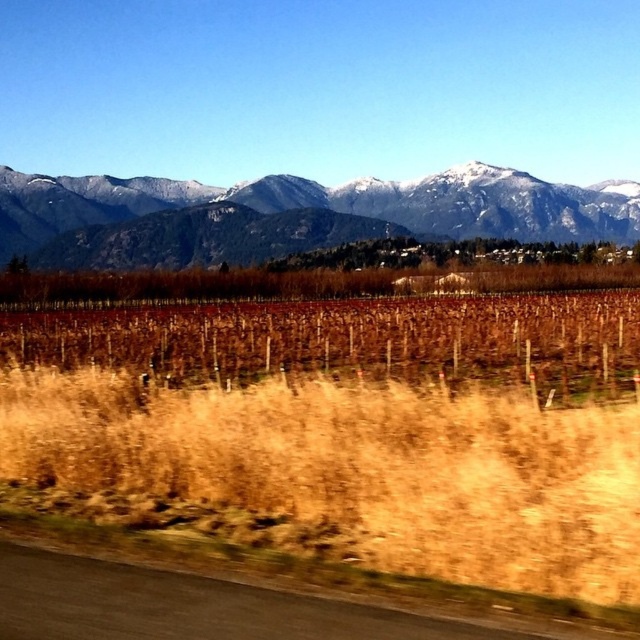
Question: Which of these objects is positioned closest to the snowy rocky mountains at upper center?

Choices:
 (A) black asphalt road at lower left
 (B) dry grass at lower center

Answer: (B)

Question: Which point is farther from the camera taking this photo?

Choices:
 (A) (129, 419)
 (B) (99, 248)
 (C) (83, 621)

Answer: (B)

Question: Considering the relative positions of dry grass at lower center and snowy rocky mountains at upper center in the image provided, where is dry grass at lower center located with respect to snowy rocky mountains at upper center?

Choices:
 (A) left
 (B) right

Answer: (A)

Question: Considering the relative positions of snowy rocky mountains at upper center and black asphalt road at lower left in the image provided, where is snowy rocky mountains at upper center located with respect to black asphalt road at lower left?

Choices:
 (A) below
 (B) above

Answer: (B)

Question: Can you confirm if dry grass at lower center is positioned to the right of snowy rocky mountains at upper center?

Choices:
 (A) yes
 (B) no

Answer: (B)

Question: Based on their relative distances, which object is farther from the dry grass at lower center?

Choices:
 (A) snowy rocky mountains at upper center
 (B) black asphalt road at lower left

Answer: (A)